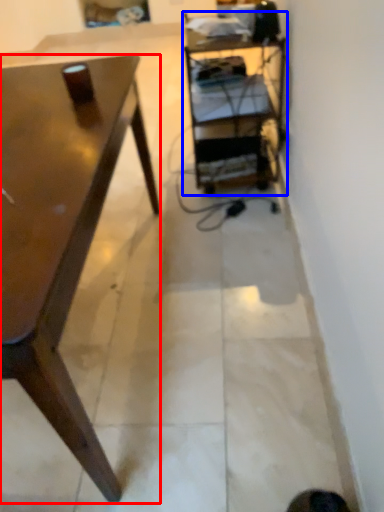
Question: Which of the following is the farthest to the observer, desk (highlighted by a red box) or shelf (highlighted by a blue box)?

Choices:
 (A) desk
 (B) shelf

Answer: (B)